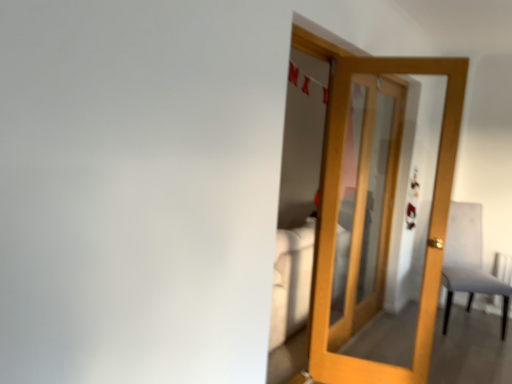
Question: Choose the correct answer: Is wooden door at center inside white fabric chair at right or outside it?

Choices:
 (A) outside
 (B) inside

Answer: (A)

Question: From the image's perspective, is wooden door at center located above or below white fabric chair at right?

Choices:
 (A) above
 (B) below

Answer: (A)

Question: From a real-world perspective, is wooden door at center physically located above or below white fabric chair at right?

Choices:
 (A) above
 (B) below

Answer: (A)

Question: Looking at the image, does white fabric chair at right seem bigger or smaller compared to wooden door at center?

Choices:
 (A) small
 (B) big

Answer: (B)

Question: In the image, is white fabric chair at right positioned in front of or behind wooden door at center?

Choices:
 (A) front
 (B) behind

Answer: (B)

Question: In terms of width, does white fabric chair at right look wider or thinner when compared to wooden door at center?

Choices:
 (A) wide
 (B) thin

Answer: (A)

Question: Is white fabric chair at right to the left or to the right of wooden door at center in the image?

Choices:
 (A) left
 (B) right

Answer: (B)